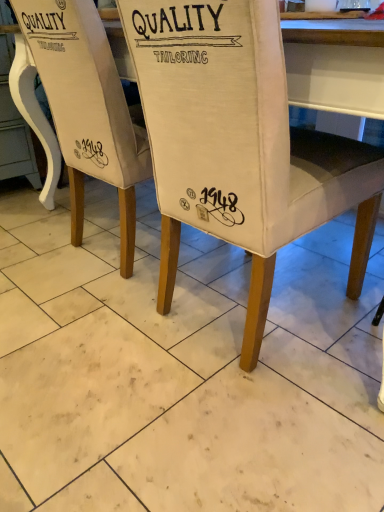
This screenshot has height=512, width=384. Describe the element at coordinates (88, 109) in the screenshot. I see `canvas chair at center, arranged as the second chair when viewed from the right` at that location.

Identify the location of canvas chair at center, arranged as the second chair when viewed from the right. (88, 109).

Describe the element at coordinates (239, 144) in the screenshot. I see `white fabric chair at center, marked as the second chair in a left-to-right arrangement` at that location.

The width and height of the screenshot is (384, 512). I want to click on white fabric chair at center, which is the first chair in right-to-left order, so click(239, 144).

This screenshot has width=384, height=512. Identify the location of canvas chair at center, arranged as the second chair when viewed from the right. (88, 109).

Consider the image. In the image, is white fabric chair at center, which is the first chair in right-to-left order, on the left side or the right side of canvas chair at center, arranged as the 1th chair when viewed from the left?

In the image, white fabric chair at center, which is the first chair in right-to-left order, appears on the right side of canvas chair at center, arranged as the 1th chair when viewed from the left.

Between white fabric chair at center, marked as the second chair in a left-to-right arrangement, and canvas chair at center, arranged as the second chair when viewed from the right, which one is positioned behind?

canvas chair at center, arranged as the second chair when viewed from the right.

Considering the points (246, 2) and (35, 5), which point is behind, point (246, 2) or point (35, 5)?

The point (35, 5) is more distant.

From the image's perspective, is white fabric chair at center, which is the first chair in right-to-left order, located above canvas chair at center, arranged as the 1th chair when viewed from the left?

No, from the image's perspective, white fabric chair at center, which is the first chair in right-to-left order, is not over canvas chair at center, arranged as the 1th chair when viewed from the left.

From a real-world perspective, is white fabric chair at center, marked as the second chair in a left-to-right arrangement, physically below canvas chair at center, arranged as the second chair when viewed from the right?

Yes, from a real-world perspective, white fabric chair at center, marked as the second chair in a left-to-right arrangement, is below canvas chair at center, arranged as the second chair when viewed from the right.

Which object is thinner, white fabric chair at center, marked as the second chair in a left-to-right arrangement, or canvas chair at center, arranged as the second chair when viewed from the right?

With smaller width is canvas chair at center, arranged as the second chair when viewed from the right.

Does white fabric chair at center, which is the first chair in right-to-left order, have a greater height compared to canvas chair at center, arranged as the 1th chair when viewed from the left?

Incorrect, the height of white fabric chair at center, which is the first chair in right-to-left order, is not larger of that of canvas chair at center, arranged as the 1th chair when viewed from the left.

Based on their sizes in the image, would you say white fabric chair at center, which is the first chair in right-to-left order, is bigger or smaller than canvas chair at center, arranged as the 1th chair when viewed from the left?

white fabric chair at center, which is the first chair in right-to-left order, is bigger than canvas chair at center, arranged as the 1th chair when viewed from the left.

Is white fabric chair at center, which is the first chair in right-to-left order, situated inside canvas chair at center, arranged as the 1th chair when viewed from the left, or outside?

white fabric chair at center, which is the first chair in right-to-left order, is outside canvas chair at center, arranged as the 1th chair when viewed from the left.

Would you consider white fabric chair at center, marked as the second chair in a left-to-right arrangement, to be distant from canvas chair at center, arranged as the 1th chair when viewed from the left?

They are positioned close to each other.

Is canvas chair at center, arranged as the 1th chair when viewed from the left, at the back of white fabric chair at center, marked as the second chair in a left-to-right arrangement?

white fabric chair at center, marked as the second chair in a left-to-right arrangement, does not have its back to canvas chair at center, arranged as the 1th chair when viewed from the left.

What's the angular difference between white fabric chair at center, which is the first chair in right-to-left order, and canvas chair at center, arranged as the second chair when viewed from the right,'s facing directions?

The angle between the facing direction of white fabric chair at center, which is the first chair in right-to-left order, and the facing direction of canvas chair at center, arranged as the second chair when viewed from the right, is 0.00029 degrees.

Locate an element on the screen. chair that is above the white fabric chair at center, which is the first chair in right-to-left order (from a real-world perspective) is located at coordinates (88, 109).

From the picture: Between canvas chair at center, arranged as the 1th chair when viewed from the left, and white fabric chair at center, marked as the second chair in a left-to-right arrangement, which one appears on the left side from the viewer's perspective?

canvas chair at center, arranged as the 1th chair when viewed from the left, is more to the left.

Does canvas chair at center, arranged as the 1th chair when viewed from the left, come in front of white fabric chair at center, marked as the second chair in a left-to-right arrangement?

No, it is not.

Which is closer to the camera, (106, 168) or (350, 279)?

Point (106, 168) is farther from the camera than point (350, 279).

From the image's perspective, relative to white fabric chair at center, marked as the second chair in a left-to-right arrangement, is canvas chair at center, arranged as the 1th chair when viewed from the left, above or below?

Clearly, from the image's perspective, canvas chair at center, arranged as the 1th chair when viewed from the left, is above white fabric chair at center, marked as the second chair in a left-to-right arrangement.

From a real-world perspective, is canvas chair at center, arranged as the 1th chair when viewed from the left, positioned under white fabric chair at center, marked as the second chair in a left-to-right arrangement, based on gravity?

No, from a real-world perspective, canvas chair at center, arranged as the 1th chair when viewed from the left, is not under white fabric chair at center, marked as the second chair in a left-to-right arrangement.

Which object is thinner, canvas chair at center, arranged as the second chair when viewed from the right, or white fabric chair at center, marked as the second chair in a left-to-right arrangement?

With smaller width is canvas chair at center, arranged as the second chair when viewed from the right.

Is canvas chair at center, arranged as the 1th chair when viewed from the left, taller than white fabric chair at center, marked as the second chair in a left-to-right arrangement?

Yes.

Does canvas chair at center, arranged as the second chair when viewed from the right, have a smaller size compared to white fabric chair at center, which is the first chair in right-to-left order?

Answer: Yes.

Is canvas chair at center, arranged as the second chair when viewed from the right, not within white fabric chair at center, marked as the second chair in a left-to-right arrangement?

Indeed, canvas chair at center, arranged as the second chair when viewed from the right, is completely outside white fabric chair at center, marked as the second chair in a left-to-right arrangement.

Is there a large distance between canvas chair at center, arranged as the 1th chair when viewed from the left, and white fabric chair at center, which is the first chair in right-to-left order?

canvas chair at center, arranged as the 1th chair when viewed from the left, is near white fabric chair at center, which is the first chair in right-to-left order, not far away.

Is canvas chair at center, arranged as the second chair when viewed from the right, positioned with its back to white fabric chair at center, marked as the second chair in a left-to-right arrangement?

That's not correct — canvas chair at center, arranged as the second chair when viewed from the right, is not looking away from white fabric chair at center, marked as the second chair in a left-to-right arrangement.

Find the location of a particular element. This screenshot has width=384, height=512. chair in front of the canvas chair at center, arranged as the 1th chair when viewed from the left is located at coordinates (239, 144).

Image resolution: width=384 pixels, height=512 pixels. What are the coordinates of `chair in front of the canvas chair at center, arranged as the 1th chair when viewed from the left` in the screenshot? It's located at (239, 144).

Where is `chair above the white fabric chair at center, which is the first chair in right-to-left order (from the image's perspective)`? chair above the white fabric chair at center, which is the first chair in right-to-left order (from the image's perspective) is located at coordinates (88, 109).